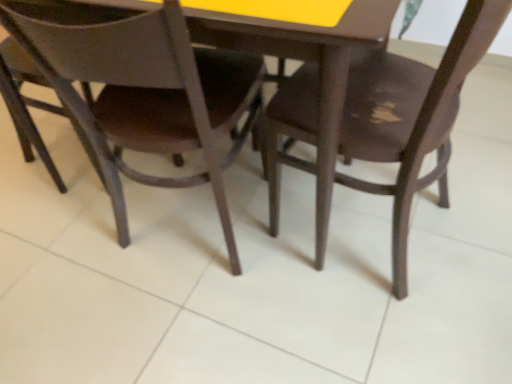
I want to click on vacant space to the right of dark wood chair at center, the 1th chair in the right-to-left sequence, so click(x=474, y=207).